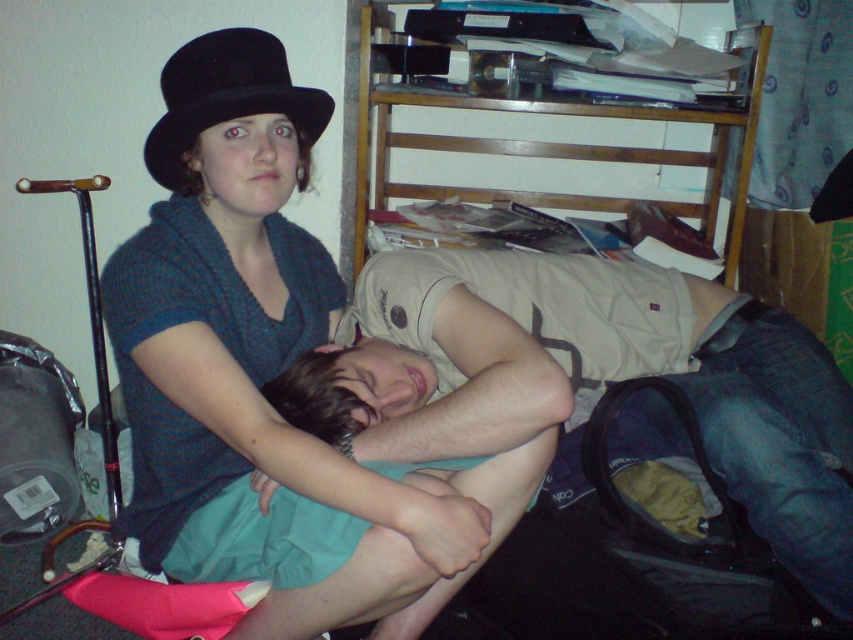
What do you see at coordinates (589, 380) in the screenshot?
I see `light beige cotton shirt at center` at bounding box center [589, 380].

Who is more forward, (819, 426) or (309, 129)?

Point (309, 129) is in front.

Where is `light beige cotton shirt at center`? The height and width of the screenshot is (640, 853). light beige cotton shirt at center is located at coordinates (589, 380).

The image size is (853, 640). What do you see at coordinates (270, 378) in the screenshot? I see `matte black hat at upper left` at bounding box center [270, 378].

Can you confirm if matte black hat at upper left is thinner than light beige cotton shirt at center?

Indeed, matte black hat at upper left has a lesser width compared to light beige cotton shirt at center.

The image size is (853, 640). In order to click on matte black hat at upper left in this screenshot , I will do `click(270, 378)`.

At what (x,y) coordinates should I click in order to perform the action: click on matte black hat at upper left. Please return your answer as a coordinate pair (x, y). This screenshot has width=853, height=640. Looking at the image, I should click on (270, 378).

Between matte black hat at upper left and black felt fedora at upper left, which one appears on the left side from the viewer's perspective?

black felt fedora at upper left is more to the left.

Between point (234, 339) and point (190, 122), which one is positioned behind?

The point (234, 339) is behind.

The width and height of the screenshot is (853, 640). Identify the location of matte black hat at upper left. (270, 378).